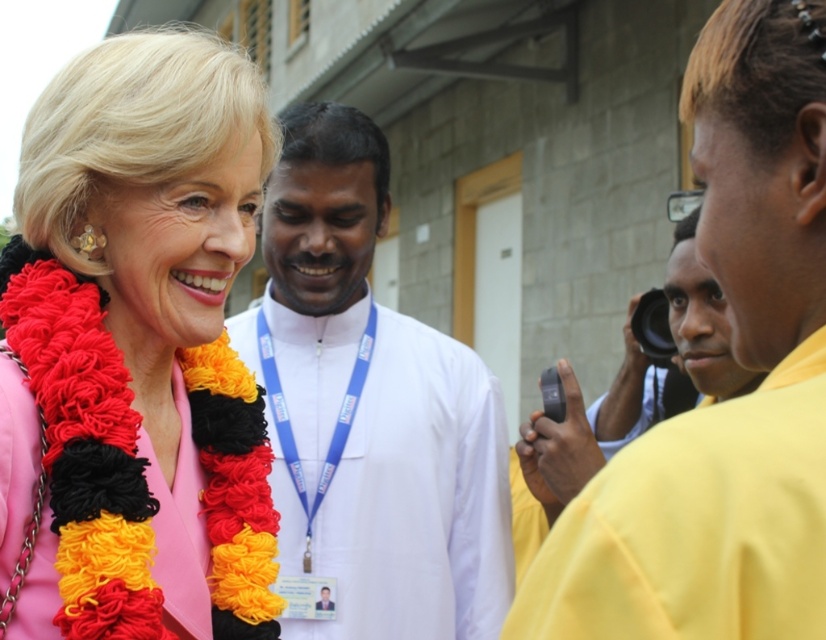
Question: Is pink fabric scarf at upper left further to the viewer compared to white cloth at center?

Choices:
 (A) no
 (B) yes

Answer: (A)

Question: Which point is closer to the camera?

Choices:
 (A) (133, 134)
 (B) (452, 632)

Answer: (A)

Question: Is pink fabric scarf at upper left thinner than yellow fabric at right?

Choices:
 (A) yes
 (B) no

Answer: (B)

Question: Can you confirm if yellow fabric at right is thinner than white cloth at center?

Choices:
 (A) no
 (B) yes

Answer: (B)

Question: Which of the following is the farthest from the observer?

Choices:
 (A) pink fabric scarf at upper left
 (B) white cloth at center

Answer: (B)

Question: Which point is farther to the camera?

Choices:
 (A) (214, 492)
 (B) (791, 77)
 (C) (266, 360)

Answer: (C)